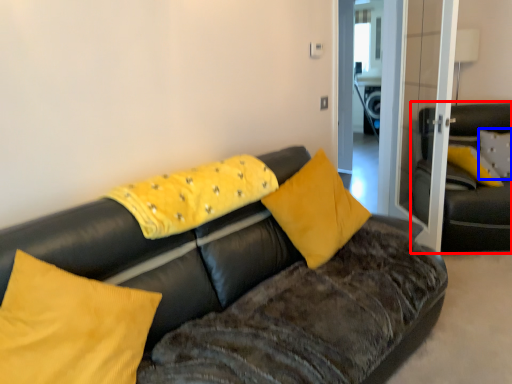
Question: Which point is further to the camera, studio couch (highlighted by a red box) or pillow (highlighted by a blue box)?

Choices:
 (A) studio couch
 (B) pillow

Answer: (B)